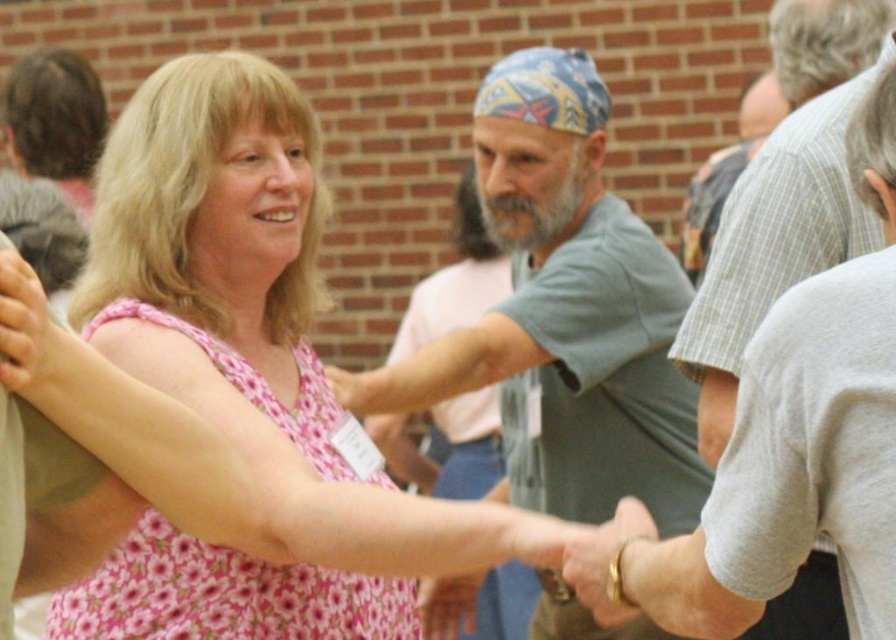
Which is more to the left, gray plaid shirt at center or gray checkered shirt at upper right?

gray plaid shirt at center is more to the left.

Image resolution: width=896 pixels, height=640 pixels. Describe the element at coordinates (773, 246) in the screenshot. I see `gray plaid shirt at center` at that location.

This screenshot has height=640, width=896. Find the location of `gray plaid shirt at center`. gray plaid shirt at center is located at coordinates (773, 246).

Does pink floral dress at center have a smaller size compared to gray cotton shirt at center?

Actually, pink floral dress at center might be larger than gray cotton shirt at center.

Which is in front, point (489, 524) or point (683, 509)?

Point (489, 524) is in front.

The width and height of the screenshot is (896, 640). In order to click on pink floral dress at center in this screenshot , I will do pos(216,396).

You are a GUI agent. You are given a task and a screenshot of the screen. Output one action in this format:
    pyautogui.click(x=<x>, y=<y>)
    Task: Click on the pink floral dress at center
    The image size is (896, 640).
    Given the screenshot: What is the action you would take?
    pyautogui.click(x=216, y=396)

Who is more distant from viewer, (104, 586) or (708, 243)?

Positioned behind is point (708, 243).

Who is more forward, (145, 232) or (747, 125)?

Positioned in front is point (145, 232).

Where is `pink floral dress at center`? The image size is (896, 640). pink floral dress at center is located at coordinates (216, 396).